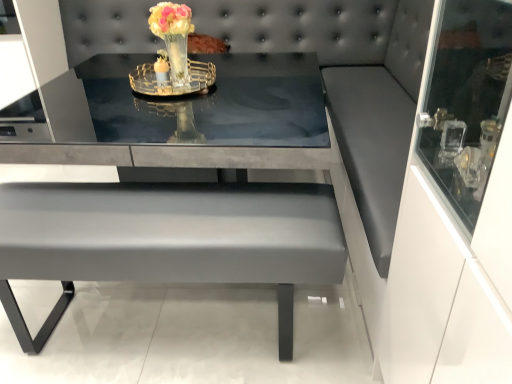
Question: Is matte gray table at center next to translucent glass vase at center?

Choices:
 (A) no
 (B) yes

Answer: (A)

Question: Would you consider matte gray table at center to be distant from translucent glass vase at center?

Choices:
 (A) no
 (B) yes

Answer: (A)

Question: Is matte gray table at center not inside translucent glass vase at center?

Choices:
 (A) no
 (B) yes

Answer: (B)

Question: Does matte gray table at center lie behind translucent glass vase at center?

Choices:
 (A) no
 (B) yes

Answer: (A)

Question: From the image's perspective, is matte gray table at center over translucent glass vase at center?

Choices:
 (A) no
 (B) yes

Answer: (A)

Question: Is matte gray table at center to the left of translucent glass vase at center from the viewer's perspective?

Choices:
 (A) yes
 (B) no

Answer: (B)

Question: Considering the relative sizes of translucent glass vase at center and matte gray table at center in the image provided, is translucent glass vase at center bigger than matte gray table at center?

Choices:
 (A) no
 (B) yes

Answer: (A)

Question: Is translucent glass vase at center facing towards matte gray table at center?

Choices:
 (A) no
 (B) yes

Answer: (A)

Question: Is translucent glass vase at center facing away from matte gray table at center?

Choices:
 (A) no
 (B) yes

Answer: (A)

Question: Would you say translucent glass vase at center is outside matte gray table at center?

Choices:
 (A) no
 (B) yes

Answer: (B)

Question: Is translucent glass vase at center shorter than matte gray table at center?

Choices:
 (A) no
 (B) yes

Answer: (B)

Question: From the image's perspective, does translucent glass vase at center appear lower than matte gray table at center?

Choices:
 (A) no
 (B) yes

Answer: (A)

Question: Considering the relative positions of matte gray table at center and translucent glass vase at center in the image provided, is matte gray table at center to the left or to the right of translucent glass vase at center?

Choices:
 (A) left
 (B) right

Answer: (B)